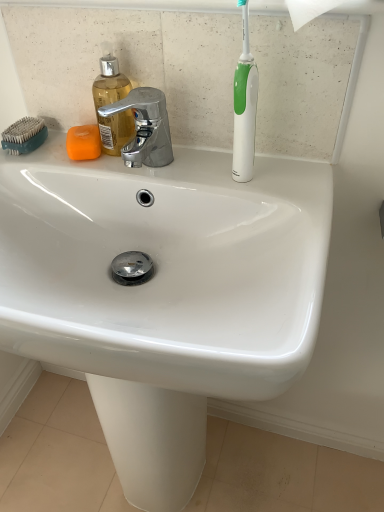
In order to click on empty space that is in between white glossy toothbrush at upper right and polished chrome faucet at upper center in this screenshot , I will do `click(205, 173)`.